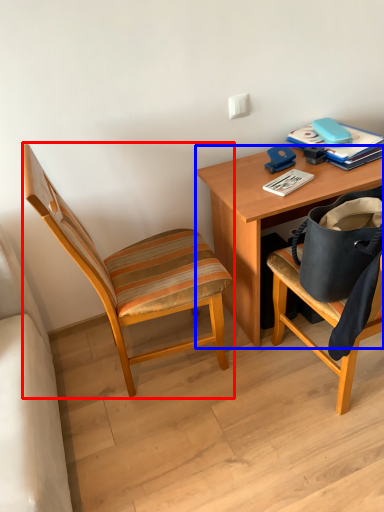
Question: Which of the following is the closest to the observer, chair (highlighted by a red box) or desk (highlighted by a blue box)?

Choices:
 (A) chair
 (B) desk

Answer: (A)